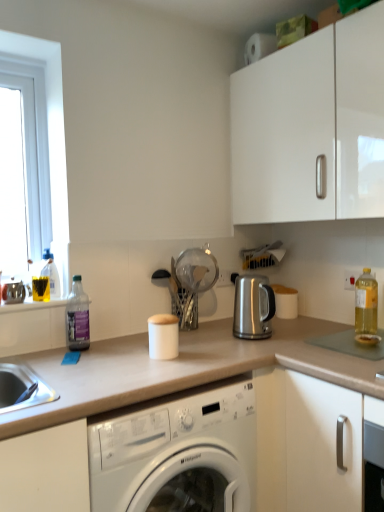
Question: Is satin silver kettle at center, placed as the 1th appliance when sorted from right to left, wider or thinner than white matte canister at center, marked as the first appliance in a left-to-right arrangement?

Choices:
 (A) thin
 (B) wide

Answer: (B)

Question: Considering the positions of satin silver kettle at center, the third appliance in the left-to-right sequence, and white matte canister at center, the 3th appliance positioned from the right, in the image, is satin silver kettle at center, the third appliance in the left-to-right sequence, taller or shorter than white matte canister at center, the 3th appliance positioned from the right,?

Choices:
 (A) short
 (B) tall

Answer: (B)

Question: Which object is positioned farthest from the transparent glass strainer at center, the 2th appliance viewed from the right?

Choices:
 (A) white matte canister at center, the 3th appliance positioned from the right
 (B) satin silver outlet at center
 (C) beige laminate countertop at center
 (D) translucent plastic bottle at left, placed as the 1th bottle when sorted from left to right
 (E) translucent yellow bottle at right, placed as the third bottle when sorted from left to right

Answer: (E)

Question: Which object is positioned farthest from the translucent yellow liquid at window left?

Choices:
 (A) translucent yellow bottle at right, placed as the third bottle when sorted from left to right
 (B) white matte canister at center, marked as the first appliance in a left-to-right arrangement
 (C) satin silver outlet at center
 (D) satin silver kettle at center, the third appliance in the left-to-right sequence
 (E) translucent plastic bottle at left, placed as the 1th bottle when sorted from left to right

Answer: (A)